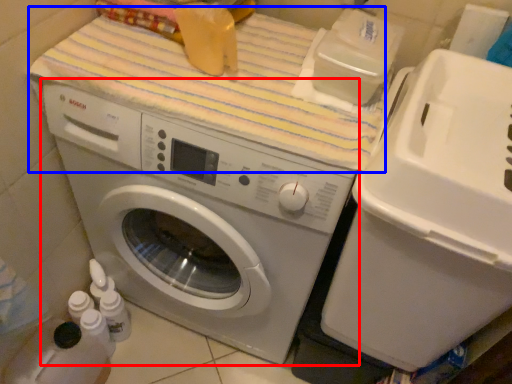
Question: Which of the following is the closest to the observer, washing machine (highlighted by a red box) or bath towel (highlighted by a blue box)?

Choices:
 (A) washing machine
 (B) bath towel

Answer: (A)